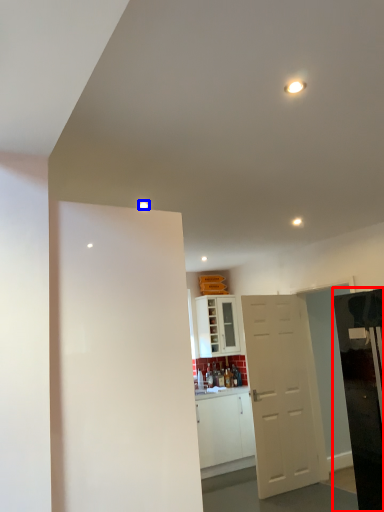
Question: Which object is further to the camera taking this photo, appliance (highlighted by a red box) or light (highlighted by a blue box)?

Choices:
 (A) appliance
 (B) light

Answer: (B)